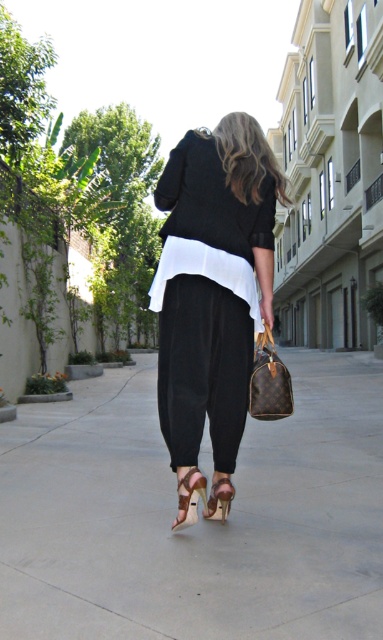
You are a photographer trying to capture the person walking down the alleyway. You need to decide whether to focus on the smooth concrete pavement at center or the brown leather handbag at lower center for a closeup shot. Which object would you choose if you want to highlight something that takes up more visual space in the frame?

The smooth concrete pavement at center is larger in size than the brown leather handbag at lower center, so focusing on it would better highlight an object that occupies more visual space in the frame.

You are a photographer trying to capture the person walking down the alleyway. You want to focus on the brown leather handbag at lower center while ensuring the smooth concrete pavement at center is still visible in the frame. Which object should you zoom in on more to prioritize the handbag?

The brown leather handbag at lower center is taller than the smooth concrete pavement at center, so you should zoom in more on the handbag to ensure it remains the focus while still keeping the pavement visible.